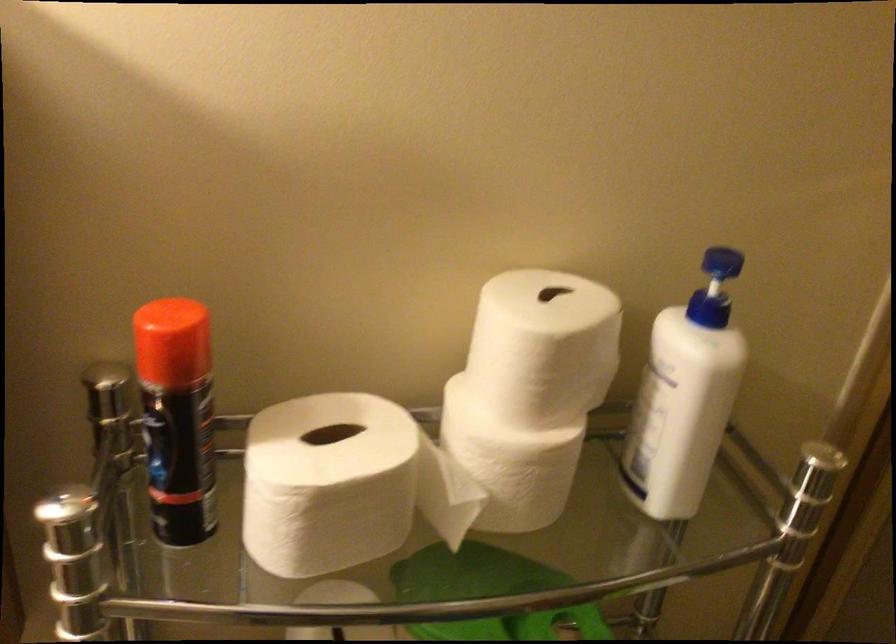
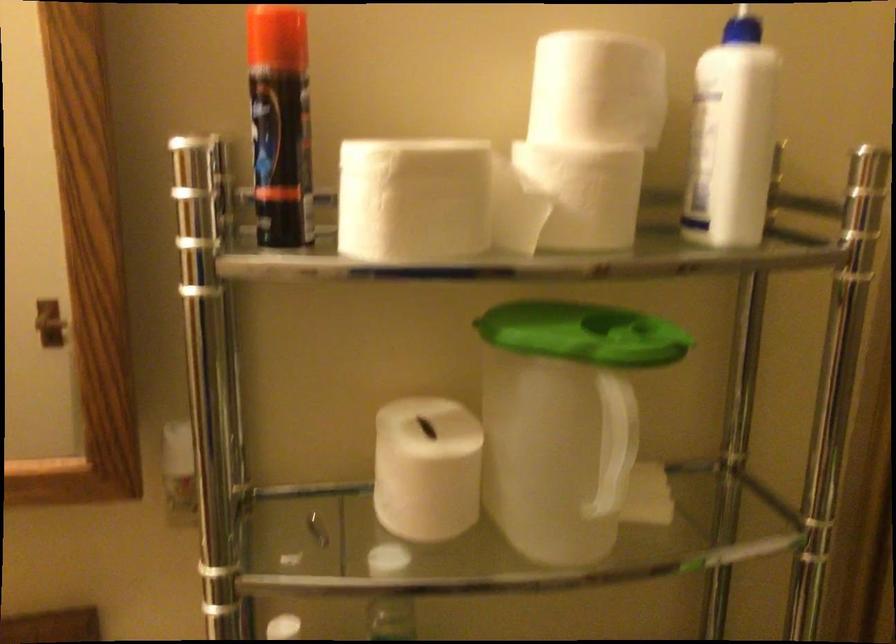
The point at [325,514] is marked in the first image. Where is the corresponding point in the second image?

(412, 200)